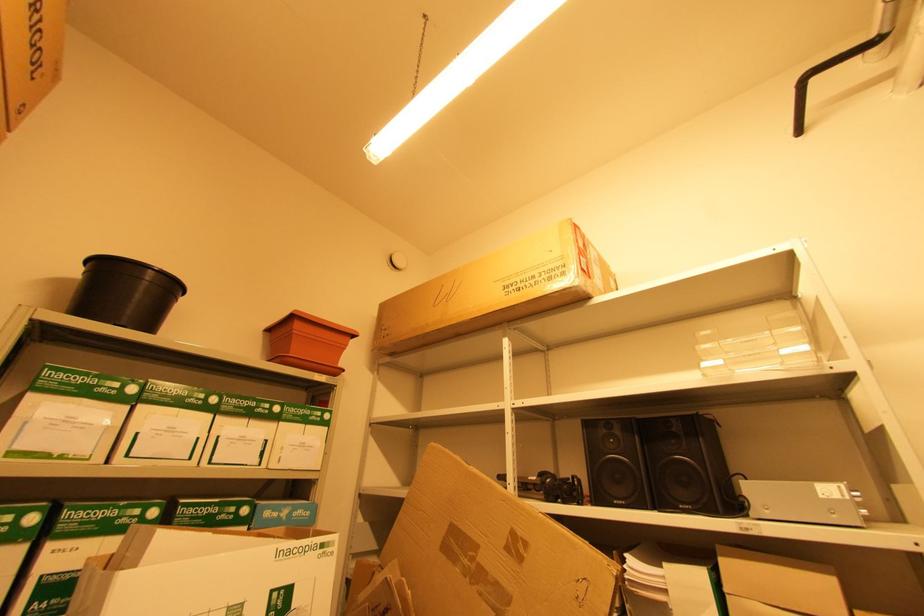
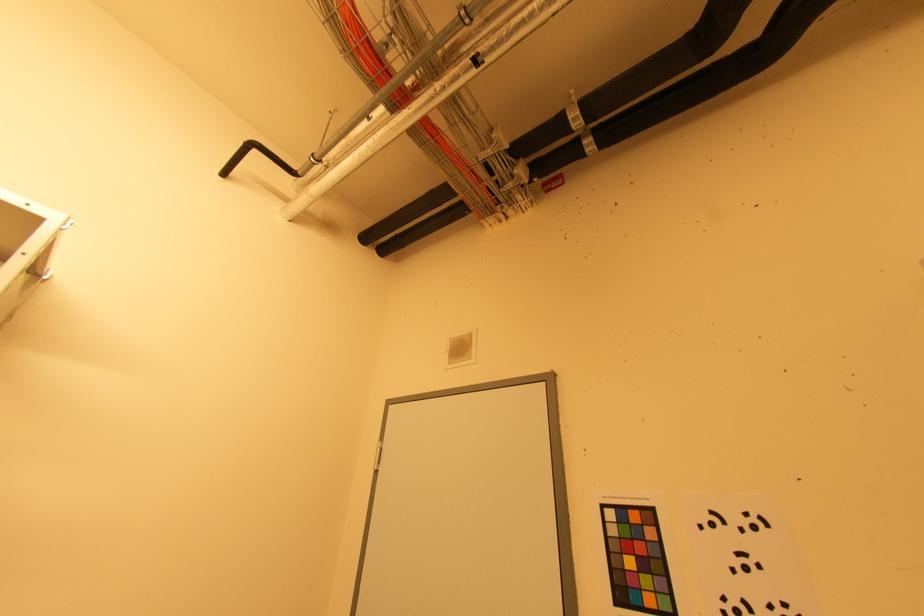
The first image is from the beginning of the video and the second image is from the end. How did the camera likely rotate when shooting the video?

The camera rotated toward right-up.